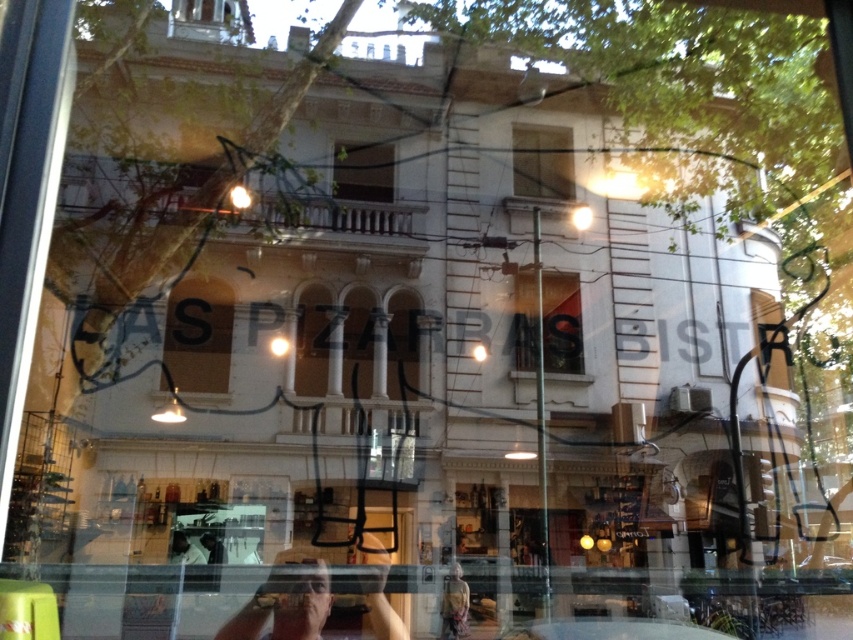
Question: Is matte wood sign at center further to camera compared to clear glass window at center?

Choices:
 (A) no
 (B) yes

Answer: (A)

Question: Which point is closer to the camera?

Choices:
 (A) clear glass window at center
 (B) clear glass window at upper center
 (C) matte black phone at center
 (D) matte wood sign at center

Answer: (C)

Question: Which point is farther from the camera taking this photo?

Choices:
 (A) (198, 364)
 (B) (514, 160)
 (C) (521, 314)

Answer: (B)

Question: From the image, what is the correct spatial relationship of matte black phone at center in relation to clear glass window at center?

Choices:
 (A) right
 (B) left

Answer: (B)

Question: Is matte wood sign at center wider than clear glass window at center?

Choices:
 (A) yes
 (B) no

Answer: (B)

Question: Which point is farther to the camera?

Choices:
 (A) (387, 621)
 (B) (387, 156)
 (C) (213, 372)

Answer: (B)